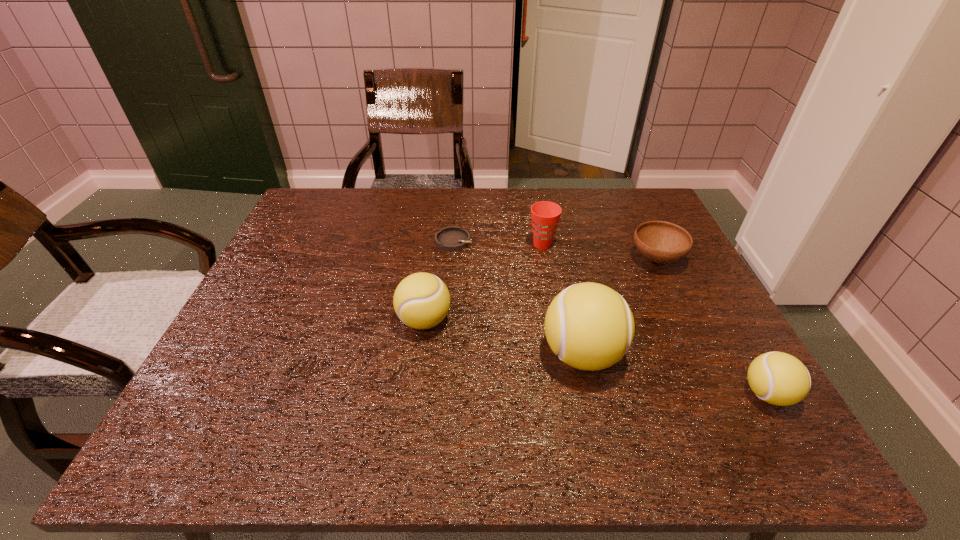
In order to click on vacant region between the cup and the bowl in this screenshot , I will do `click(599, 252)`.

Identify the location of object that is the fourth closest to the shortest tennis ball. (421, 301).

Find the location of a particular element. object identified as the second closest to the rightmost tennis ball is located at coordinates pyautogui.click(x=662, y=242).

The width and height of the screenshot is (960, 540). Find the location of `the second closest tennis ball to the second shortest tennis ball`. the second closest tennis ball to the second shortest tennis ball is located at coordinates (778, 378).

Select which tennis ball appears as the closest to the second tennis ball from left to right. Please provide its 2D coordinates. Your answer should be formatted as a tuple, i.e. [(x, y)], where the tuple contains the x and y coordinates of a point satisfying the conditions above.

[(421, 301)]

Identify the location of vacant space that satisfies the following two spatial constraints: 1. on the back side of the cup; 2. on the right side of the leftmost tennis ball. The height and width of the screenshot is (540, 960). (434, 245).